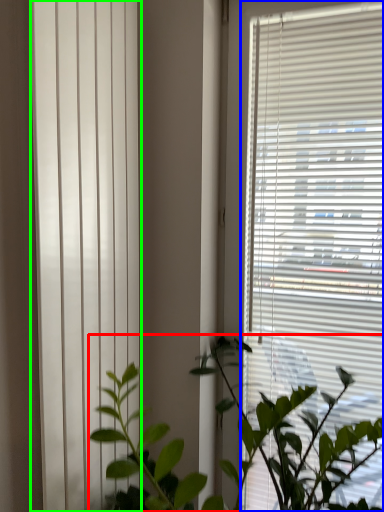
Question: Which object is the closest to the houseplant (highlighted by a red box)? Choose among these: window blind (highlighted by a blue box) or shutter (highlighted by a green box).

Choices:
 (A) window blind
 (B) shutter

Answer: (A)